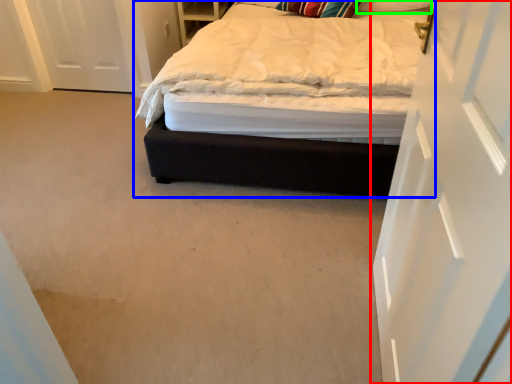
Question: Based on their relative distances, which object is farther from door (highlighted by a red box)? Choose from bed (highlighted by a blue box) and pillow (highlighted by a green box).

Choices:
 (A) bed
 (B) pillow

Answer: (B)